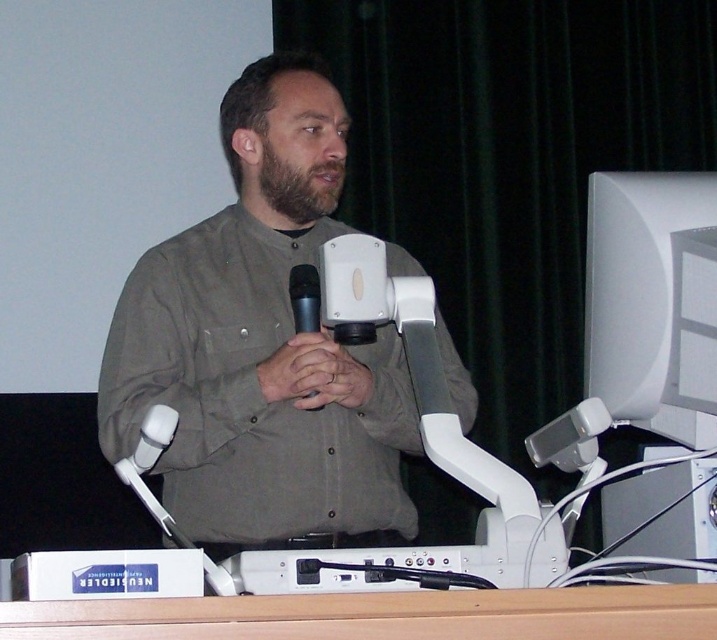
Question: Which point appears farthest from the camera in this image?

Choices:
 (A) (267, 196)
 (B) (204, 269)
 (C) (290, 304)
 (D) (163, 445)

Answer: (A)

Question: Which object is closer to the camera taking this photo?

Choices:
 (A) black matte microphone at center
 (B) white plastic microphone at lower left
 (C) brown fuzzy beard at center
 (D) matte gray shirt at center

Answer: (B)

Question: Does brown fuzzy beard at center have a greater width compared to black matte microphone at center?

Choices:
 (A) yes
 (B) no

Answer: (A)

Question: Can you confirm if matte gray shirt at center is wider than black matte microphone at center?

Choices:
 (A) no
 (B) yes

Answer: (B)

Question: Can you confirm if brown fuzzy beard at center is smaller than black matte microphone at center?

Choices:
 (A) no
 (B) yes

Answer: (A)

Question: Which object is farther from the camera taking this photo?

Choices:
 (A) black matte microphone at center
 (B) matte gray shirt at center
 (C) white plastic microphone at lower left
 (D) brown fuzzy beard at center

Answer: (D)